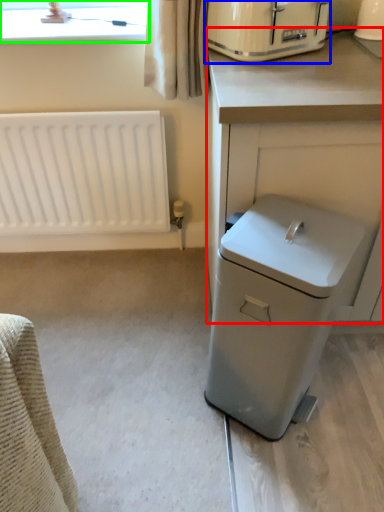
Question: Estimate the real-world distances between objects in this image. Which object is farther from counter (highlighted by a red box), home appliance (highlighted by a blue box) or bay window (highlighted by a green box)?

Choices:
 (A) home appliance
 (B) bay window

Answer: (B)